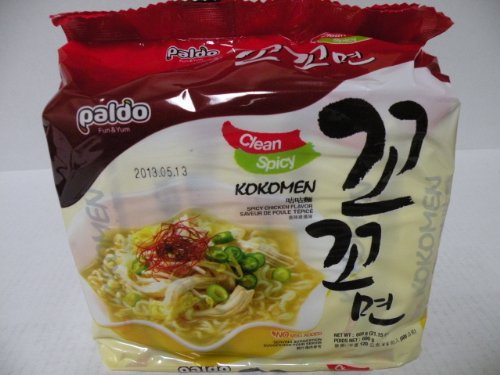
Identify the location of white wall. (22, 115).